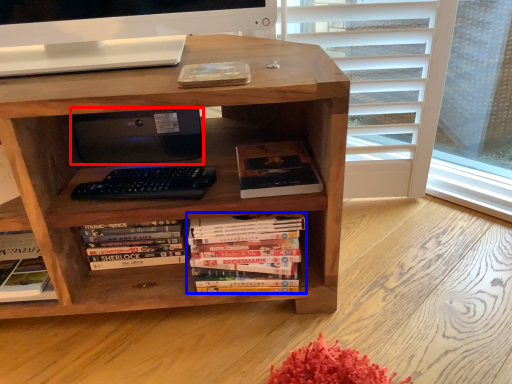
Question: Which object is further to the camera taking this photo, computer (highlighted by a red box) or book (highlighted by a blue box)?

Choices:
 (A) computer
 (B) book

Answer: (A)